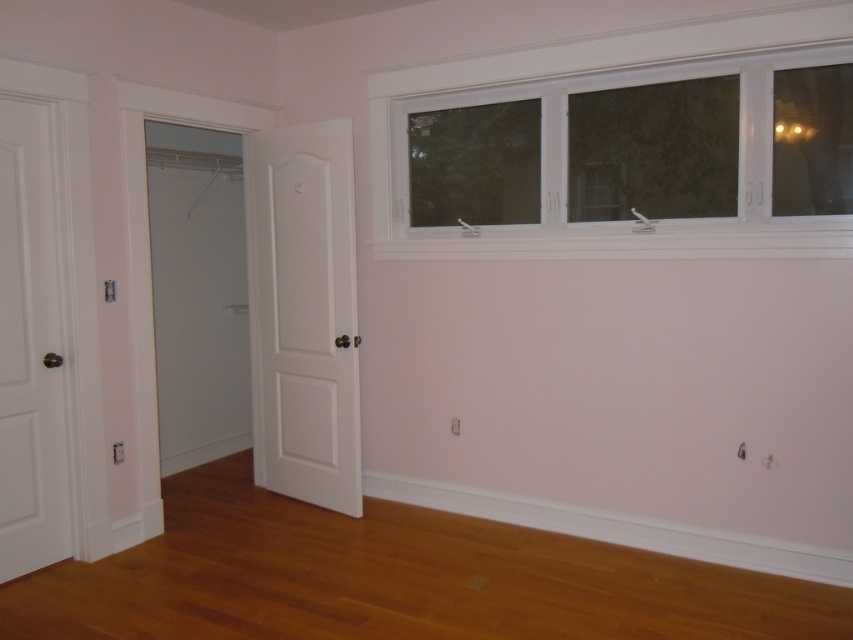
Question: Can you confirm if white plastic window at upper right is wider than white matte door at left?

Choices:
 (A) yes
 (B) no

Answer: (A)

Question: Can you confirm if white matte door at center is smaller than white matte door at left?

Choices:
 (A) yes
 (B) no

Answer: (B)

Question: Which of the following is the farthest from the observer?

Choices:
 (A) (18, 317)
 (B) (302, 273)
 (C) (766, 125)

Answer: (B)

Question: Does white plastic window at upper right have a lesser width compared to white matte door at left?

Choices:
 (A) no
 (B) yes

Answer: (A)

Question: Which of the following is the closest to the observer?

Choices:
 (A) white matte door at center
 (B) white plastic window at upper right

Answer: (B)

Question: Among these objects, which one is nearest to the camera?

Choices:
 (A) white matte door at left
 (B) white plastic window at upper right

Answer: (B)